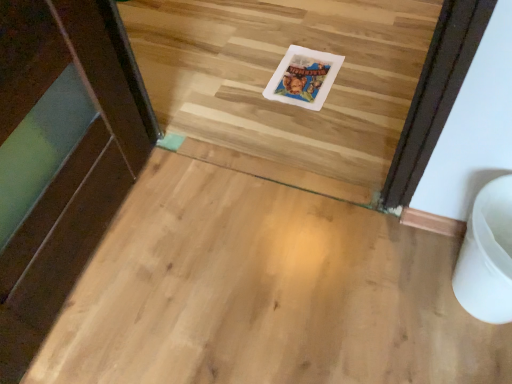
Question: From a real-world perspective, is white plastic postcard at center positioned above or below white plastic toilet bowl at lower right?

Choices:
 (A) below
 (B) above

Answer: (A)

Question: Considering the positions of white plastic postcard at center and white plastic toilet bowl at lower right in the image, is white plastic postcard at center taller or shorter than white plastic toilet bowl at lower right?

Choices:
 (A) tall
 (B) short

Answer: (B)

Question: Relative to white plastic toilet bowl at lower right, is white plastic postcard at center in front or behind?

Choices:
 (A) behind
 (B) front

Answer: (A)

Question: From a real-world perspective, is white plastic toilet bowl at lower right above or below white plastic postcard at center?

Choices:
 (A) below
 (B) above

Answer: (B)

Question: In the image, is white plastic toilet bowl at lower right positioned in front of or behind white plastic postcard at center?

Choices:
 (A) behind
 (B) front

Answer: (B)

Question: Is white plastic toilet bowl at lower right taller or shorter than white plastic postcard at center?

Choices:
 (A) short
 (B) tall

Answer: (B)

Question: Is point (503, 301) closer or farther from the camera than point (303, 97)?

Choices:
 (A) farther
 (B) closer

Answer: (B)